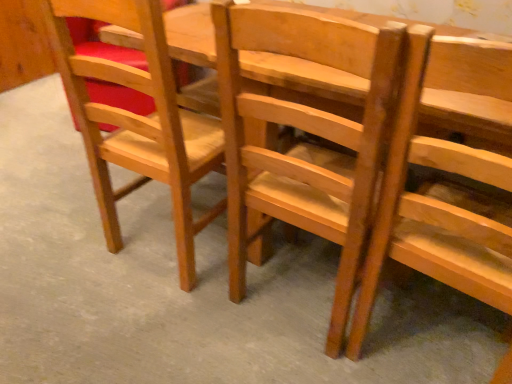
Describe the element at coordinates (441, 195) in the screenshot. This screenshot has width=512, height=384. I see `wooden chair at center, the 1th chair in the right-to-left sequence` at that location.

The height and width of the screenshot is (384, 512). Describe the element at coordinates (307, 143) in the screenshot. I see `light brown wood chair at center, the 2th chair in the left-to-right sequence` at that location.

Where is `matte wood chair at left, the first chair in the left-to-right sequence`? Image resolution: width=512 pixels, height=384 pixels. matte wood chair at left, the first chair in the left-to-right sequence is located at coordinates (137, 119).

Which is closer to the camera, (x=343, y=57) or (x=509, y=178)?

The point (x=509, y=178) is closer to the camera.

Can you confirm if light brown wood chair at center, the 2th chair in the left-to-right sequence, is bigger than wooden chair at center, the 1th chair in the right-to-left sequence?

Indeed, light brown wood chair at center, the 2th chair in the left-to-right sequence, has a larger size compared to wooden chair at center, the 1th chair in the right-to-left sequence.

Does light brown wood chair at center, the 2th chair in the left-to-right sequence, contain wooden chair at center, the 3th chair viewed from the left?

No, wooden chair at center, the 3th chair viewed from the left, is not inside light brown wood chair at center, the 2th chair in the left-to-right sequence.

From a real-world perspective, which is physically above, light brown wood chair at center, the second chair from the right, or wooden chair at center, the 3th chair viewed from the left?

From a 3D spatial view, wooden chair at center, the 3th chair viewed from the left, is above.

How many degrees apart are the facing directions of wooden chair at center, the 1th chair in the right-to-left sequence, and matte wood chair at left, which is the third chair in right-to-left order?

There is a 6.72-degree angle between the facing directions of wooden chair at center, the 1th chair in the right-to-left sequence, and matte wood chair at left, which is the third chair in right-to-left order.

I want to click on the 2nd chair positioned above the matte wood chair at left, which is the third chair in right-to-left order (from a real-world perspective), so click(441, 195).

Is wooden chair at center, the 1th chair in the right-to-left sequence, oriented away from matte wood chair at left, the first chair in the left-to-right sequence?

No.

In the scene shown: From the image's perspective, is wooden chair at center, the 1th chair in the right-to-left sequence, positioned above or below matte wood chair at left, which is the third chair in right-to-left order?

Based on their image positions, wooden chair at center, the 1th chair in the right-to-left sequence, is located beneath matte wood chair at left, which is the third chair in right-to-left order.

From a real-world perspective, is matte wood chair at left, the first chair in the left-to-right sequence, located beneath wooden chair at center, the 3th chair viewed from the left?

Indeed, from a real-world perspective, matte wood chair at left, the first chair in the left-to-right sequence, is positioned beneath wooden chair at center, the 3th chair viewed from the left.

Does matte wood chair at left, which is the third chair in right-to-left order, touch wooden chair at center, the 3th chair viewed from the left?

No, matte wood chair at left, which is the third chair in right-to-left order, is not making contact with wooden chair at center, the 3th chair viewed from the left.

Is matte wood chair at left, the first chair in the left-to-right sequence, inside the boundaries of wooden chair at center, the 1th chair in the right-to-left sequence, or outside?

matte wood chair at left, the first chair in the left-to-right sequence, is not enclosed by wooden chair at center, the 1th chair in the right-to-left sequence.

Considering the relative sizes of matte wood chair at left, the first chair in the left-to-right sequence, and wooden chair at center, the 3th chair viewed from the left, in the image provided, is matte wood chair at left, the first chair in the left-to-right sequence, smaller than wooden chair at center, the 3th chair viewed from the left,?

No.

From the image's perspective, is matte wood chair at left, which is the third chair in right-to-left order, on top of light brown wood chair at center, the 2th chair in the left-to-right sequence?

Correct, matte wood chair at left, which is the third chair in right-to-left order, appears higher than light brown wood chair at center, the 2th chair in the left-to-right sequence, in the image.

Is the depth of matte wood chair at left, the first chair in the left-to-right sequence, less than that of light brown wood chair at center, the second chair from the right?

No.

Can you confirm if matte wood chair at left, which is the third chair in right-to-left order, is thinner than light brown wood chair at center, the 2th chair in the left-to-right sequence?

Yes, matte wood chair at left, which is the third chair in right-to-left order, is thinner than light brown wood chair at center, the 2th chair in the left-to-right sequence.

How many degrees apart are the facing directions of matte wood chair at left, which is the third chair in right-to-left order, and light brown wood chair at center, the 2th chair in the left-to-right sequence?

They differ by 1.92 degrees in their facing directions.

Identify the location of chair below the light brown wood chair at center, the 2th chair in the left-to-right sequence (from the image's perspective). The image size is (512, 384). (441, 195).

From a real-world perspective, is wooden chair at center, the 1th chair in the right-to-left sequence, located higher than light brown wood chair at center, the 2th chair in the left-to-right sequence?

Correct, in the physical world, wooden chair at center, the 1th chair in the right-to-left sequence, is higher than light brown wood chair at center, the 2th chair in the left-to-right sequence.

Between wooden chair at center, the 3th chair viewed from the left, and light brown wood chair at center, the second chair from the right, which one has smaller size?

Smaller between the two is wooden chair at center, the 3th chair viewed from the left.

Is wooden chair at center, the 1th chair in the right-to-left sequence, thinner than light brown wood chair at center, the second chair from the right?

Yes, wooden chair at center, the 1th chair in the right-to-left sequence, is thinner than light brown wood chair at center, the second chair from the right.

Can you confirm if light brown wood chair at center, the second chair from the right, is thinner than matte wood chair at left, the first chair in the left-to-right sequence?

No.

Which object is further away from the camera taking this photo, light brown wood chair at center, the second chair from the right, or matte wood chair at left, the first chair in the left-to-right sequence?

matte wood chair at left, the first chair in the left-to-right sequence, is behind.

From their relative heights in the image, would you say light brown wood chair at center, the 2th chair in the left-to-right sequence, is taller or shorter than matte wood chair at left, the first chair in the left-to-right sequence?

Clearly, light brown wood chair at center, the 2th chair in the left-to-right sequence, is taller compared to matte wood chair at left, the first chair in the left-to-right sequence.

From a real-world perspective, which is physically below, light brown wood chair at center, the 2th chair in the left-to-right sequence, or matte wood chair at left, which is the third chair in right-to-left order?

matte wood chair at left, which is the third chair in right-to-left order.

Where is `chair above the light brown wood chair at center, the 2th chair in the left-to-right sequence (from a real-world perspective)`? chair above the light brown wood chair at center, the 2th chair in the left-to-right sequence (from a real-world perspective) is located at coordinates (441, 195).

From a real-world perspective, starting from the wooden chair at center, the 1th chair in the right-to-left sequence, which chair is the 2nd one below it? Please provide its 2D coordinates.

[(137, 119)]

Looking at the image, which one is located closer to light brown wood chair at center, the 2th chair in the left-to-right sequence, matte wood chair at left, the first chair in the left-to-right sequence, or wooden chair at center, the 1th chair in the right-to-left sequence?

Among the two, wooden chair at center, the 1th chair in the right-to-left sequence, is located nearer to light brown wood chair at center, the 2th chair in the left-to-right sequence.

From the image, which object appears to be farther from light brown wood chair at center, the 2th chair in the left-to-right sequence, wooden chair at center, the 3th chair viewed from the left, or matte wood chair at left, which is the third chair in right-to-left order?

matte wood chair at left, which is the third chair in right-to-left order, is further to light brown wood chair at center, the 2th chair in the left-to-right sequence.

Considering their positions, is light brown wood chair at center, the second chair from the right, positioned further to matte wood chair at left, which is the third chair in right-to-left order, than wooden chair at center, the 1th chair in the right-to-left sequence?

Among the two, wooden chair at center, the 1th chair in the right-to-left sequence, is located further to matte wood chair at left, which is the third chair in right-to-left order.

Consider the image. Which object lies nearer to the anchor point wooden chair at center, the 1th chair in the right-to-left sequence, matte wood chair at left, the first chair in the left-to-right sequence, or light brown wood chair at center, the second chair from the right?

Among the two, light brown wood chair at center, the second chair from the right, is located nearer to wooden chair at center, the 1th chair in the right-to-left sequence.

Which object lies nearer to the anchor point wooden chair at center, the 1th chair in the right-to-left sequence, light brown wood chair at center, the second chair from the right, or matte wood chair at left, which is the third chair in right-to-left order?

light brown wood chair at center, the second chair from the right, is positioned closer to the anchor wooden chair at center, the 1th chair in the right-to-left sequence.

Consider the image. When comparing their distances from matte wood chair at left, which is the third chair in right-to-left order, does wooden chair at center, the 3th chair viewed from the left, or light brown wood chair at center, the second chair from the right, seem further?

wooden chair at center, the 3th chair viewed from the left, is positioned further to the anchor matte wood chair at left, which is the third chair in right-to-left order.

Where is `chair between matte wood chair at left, which is the third chair in right-to-left order, and wooden chair at center, the 3th chair viewed from the left`? chair between matte wood chair at left, which is the third chair in right-to-left order, and wooden chair at center, the 3th chair viewed from the left is located at coordinates (307, 143).